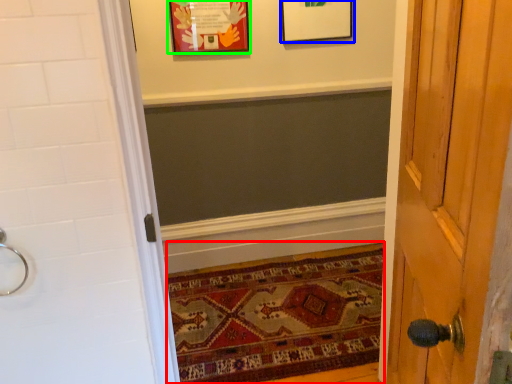
Question: Considering the real-world distances, which object is farthest from mat (highlighted by a red box)? picture frame (highlighted by a blue box) or picture frame (highlighted by a green box)?

Choices:
 (A) picture frame
 (B) picture frame

Answer: (A)